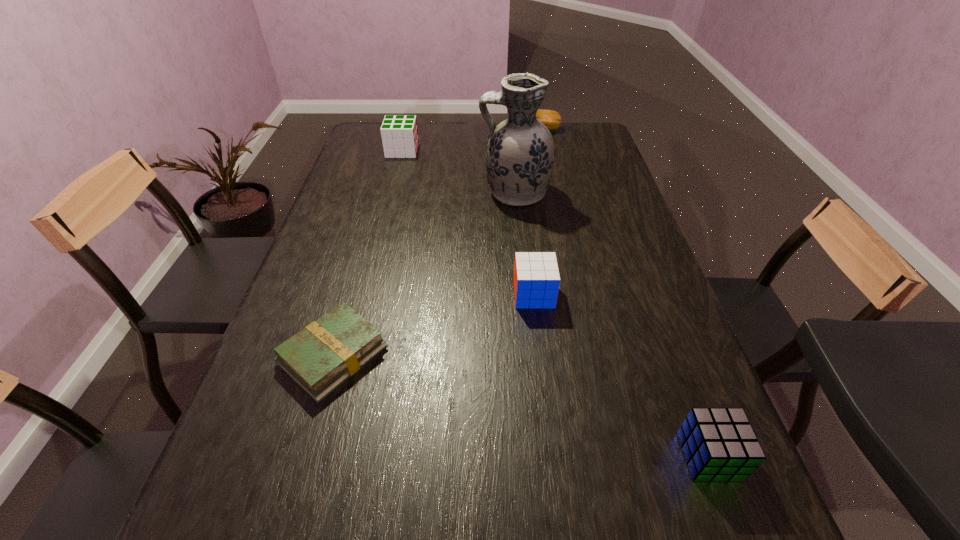
In the image, there is a desktop. Find the location of `free space at the left edge`. free space at the left edge is located at coordinates (283, 393).

Locate an element on the screen. The height and width of the screenshot is (540, 960). vacant space at the right edge of the desktop is located at coordinates (634, 415).

The width and height of the screenshot is (960, 540). Identify the location of vacant space at the far left corner. (377, 123).

What are the coordinates of `free space at the far right corner of the desktop` in the screenshot? It's located at point(594,144).

You are a GUI agent. You are given a task and a screenshot of the screen. Output one action in this format:
    pyautogui.click(x=<x>, y=<y>)
    Task: Click on the vacant point located between the second nearest cube and the second nearest object
    The height and width of the screenshot is (540, 960).
    Given the screenshot: What is the action you would take?
    pyautogui.click(x=434, y=325)

Image resolution: width=960 pixels, height=540 pixels. What are the coordinates of `empty location between the fifth farthest object and the third farthest object` in the screenshot? It's located at (424, 274).

You are a GUI agent. You are given a task and a screenshot of the screen. Output one action in this format:
    pyautogui.click(x=<x>, y=<y>)
    Task: Click on the free space between the third farthest object and the farthest cube
    This screenshot has width=960, height=540.
    Given the screenshot: What is the action you would take?
    pyautogui.click(x=458, y=172)

Image resolution: width=960 pixels, height=540 pixels. I want to click on vacant point located between the fifth farthest object and the nearest cube, so click(x=521, y=406).

The image size is (960, 540). What are the coordinates of `vacant space in between the farthest cube and the gourd` in the screenshot? It's located at (469, 140).

Where is `vacant space in between the nearest object and the farthest object`? This screenshot has width=960, height=540. vacant space in between the nearest object and the farthest object is located at coordinates (622, 293).